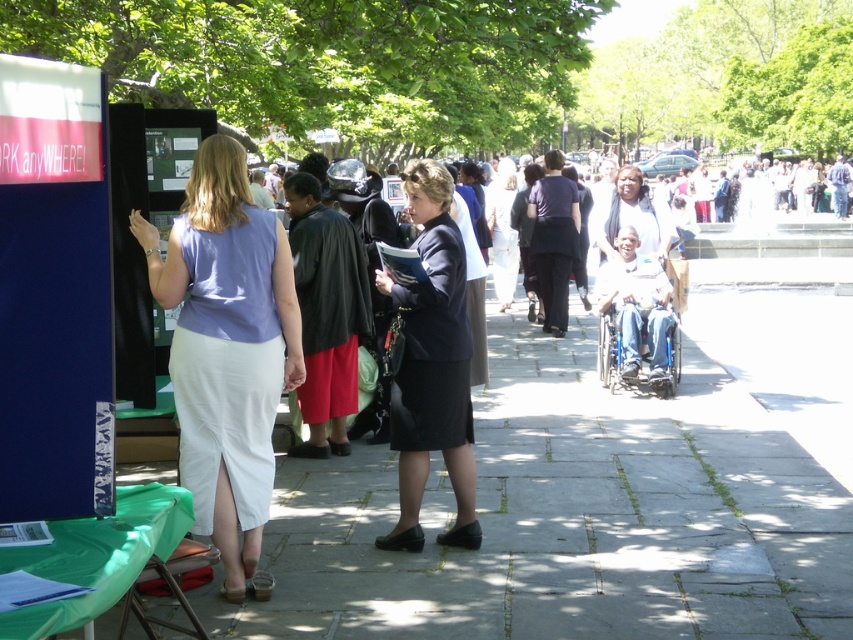
You are standing at the camera position and want to walk to both points. Which point should you reach first, point (201, 214) or point (447, 444)?

You should reach point (201, 214) first because it is closer to the camera than point (447, 444).

Consider the image. You are a tailor who needs to determine which item has a narrower width between the black fabric skirt at center and the white cotton shirt at center. Which one is narrower?

The black fabric skirt at center is narrower than the white cotton shirt at center according to the description.